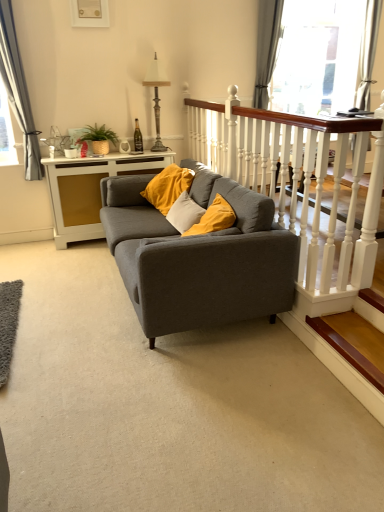
This screenshot has height=512, width=384. What are the coordinates of `vacant space in front of matte gray couch at center` in the screenshot? It's located at (172, 400).